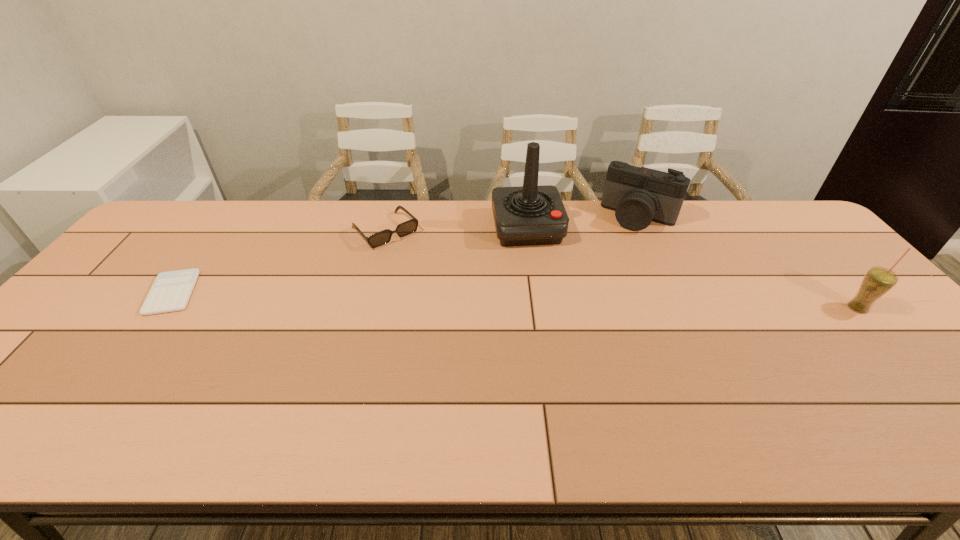
Locate an element on the screen. The width and height of the screenshot is (960, 540). the leftmost object is located at coordinates (171, 291).

Identify the location of calculator. This screenshot has height=540, width=960. (171, 291).

Locate an element on the screen. straw for drinking is located at coordinates (877, 281).

Find the location of a particular element. the third object from left to right is located at coordinates (527, 215).

You are a GUI agent. You are given a task and a screenshot of the screen. Output one action in this format:
    pyautogui.click(x=<x>, y=<y>)
    Task: Click on the joystick
    
    Given the screenshot: What is the action you would take?
    pyautogui.click(x=527, y=215)

The width and height of the screenshot is (960, 540). Identify the location of sunglasses. (383, 237).

Find the location of a particular element. The image size is (960, 540). the fourth object from right to left is located at coordinates (383, 237).

Image resolution: width=960 pixels, height=540 pixels. Find the location of `camera`. camera is located at coordinates (638, 196).

This screenshot has width=960, height=540. I want to click on free spot located 0.090m on the left of the calculator, so click(x=115, y=293).

The image size is (960, 540). I want to click on vacant area located 0.140m on the back of the straw for drinking, so (x=821, y=266).